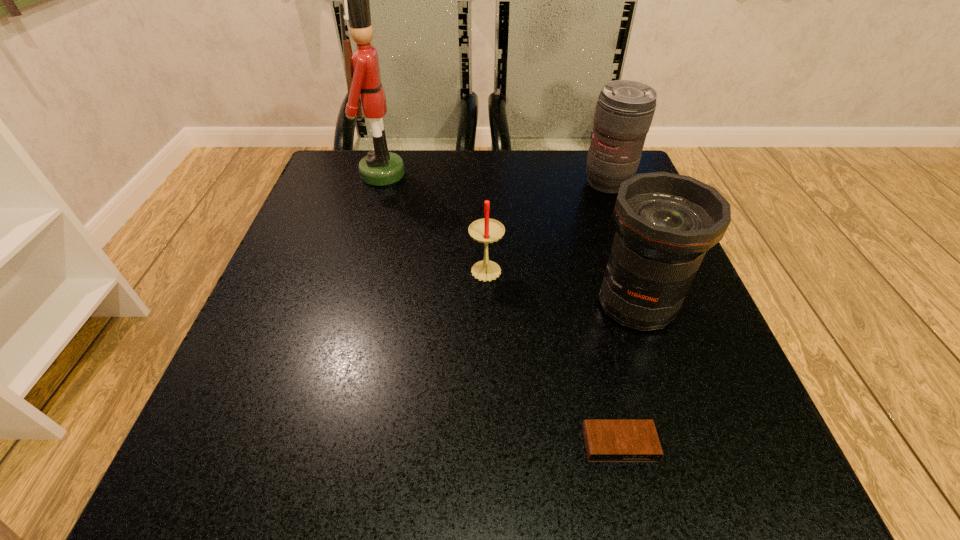
Locate an element on the screen. free space located 0.250m on the back of the nearer telephoto lens is located at coordinates (600, 196).

What are the coordinates of `vacant area situated 0.220m on the back of the fourth object from right to left` in the screenshot? It's located at (485, 194).

Locate an element on the screen. The width and height of the screenshot is (960, 540). nutcracker present at the far edge is located at coordinates (380, 167).

This screenshot has width=960, height=540. I want to click on telephoto lens at the far edge, so click(624, 111).

Find the location of a particular element. object that is at the near edge is located at coordinates (606, 440).

Locate an element on the screen. This screenshot has width=960, height=540. object that is at the left edge is located at coordinates (380, 167).

Where is `alarm clock at the right edge`? alarm clock at the right edge is located at coordinates (606, 440).

You are a GUI agent. You are given a task and a screenshot of the screen. Output one action in this format:
    pyautogui.click(x=<x>, y=<y>)
    Task: Click on the object situated at the far left corner
    The width and height of the screenshot is (960, 540).
    Given the screenshot: What is the action you would take?
    pyautogui.click(x=380, y=167)

Where is `object located at the far right corner`? Image resolution: width=960 pixels, height=540 pixels. object located at the far right corner is located at coordinates (624, 111).

Image resolution: width=960 pixels, height=540 pixels. I want to click on object positioned at the near right corner, so click(x=606, y=440).